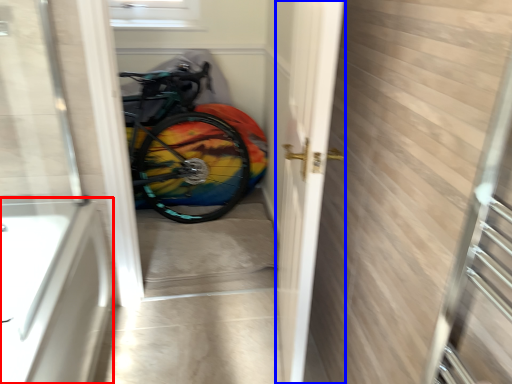
Question: Which object appears farthest to the camera in this image, bath (highlighted by a red box) or screen door (highlighted by a blue box)?

Choices:
 (A) bath
 (B) screen door

Answer: (A)